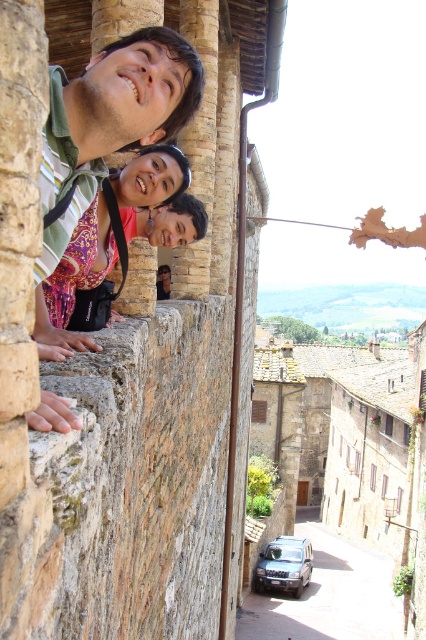
You are a photographer trying to capture a wide shot of the scenic overlook. You have a matte black camera at upper left and a dark gray metallic car at lower center in your current frame. Which object should you adjust your focus to prioritize for a clear shot, considering their sizes in the frame?

The matte black camera at upper left occupies less space than the dark gray metallic car at lower center, so you should prioritize focusing on the dark gray metallic car at lower center to ensure it is clear in the wide shot.

You are a photographer trying to capture the scene of three people leaning on a stone wall. You have a matte black camera at upper left and a dark gray metallic car at lower center in your viewfinder. Which object is positioned to the left side of the other?

The matte black camera at upper left is positioned to the left of the dark gray metallic car at lower center.